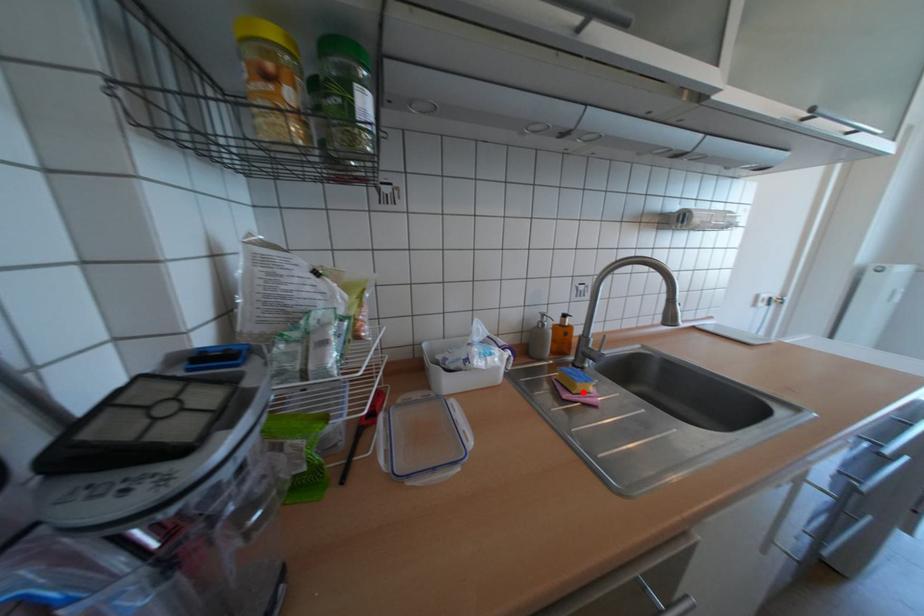
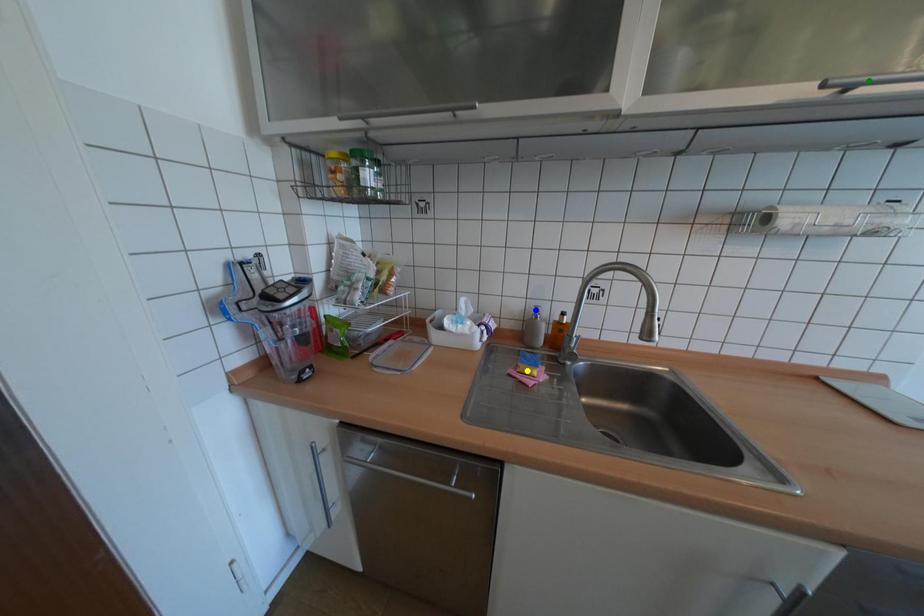
Question: I am providing you with two images of the same scene from different viewpoints. A red point is marked on the first image. You are given multiple points on the second image. Can you choose the point in image 2 that corresponds to the point in image 1?

Choices:
 (A) blue point
 (B) green point
 (C) yellow point

Answer: (C)